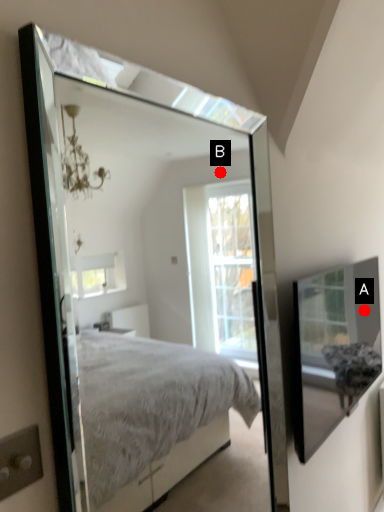
Question: Two points are circled on the image, labeled by A and B beside each circle. Which point is farther to the camera?

Choices:
 (A) A is further
 (B) B is further

Answer: (B)